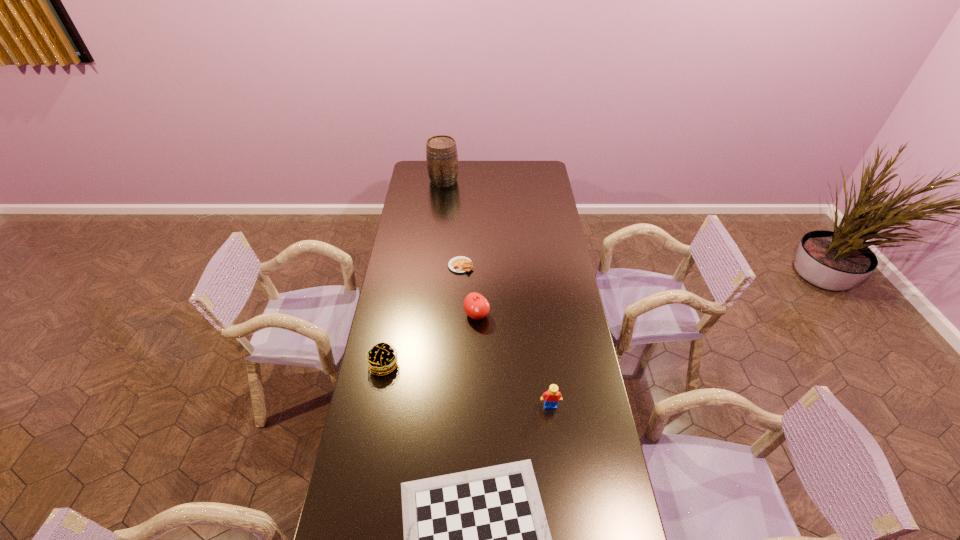
The height and width of the screenshot is (540, 960). I want to click on blank region between the apple and the tallest object, so click(460, 247).

Locate an element on the screen. The image size is (960, 540). empty space between the apple and the farthest object is located at coordinates (460, 247).

At what (x,y) coordinates should I click in order to perform the action: click on vacant space that's between the second nearest object and the omelet. Please return your answer as a coordinate pair (x, y). This screenshot has width=960, height=540. Looking at the image, I should click on (506, 336).

At what (x,y) coordinates should I click in order to perform the action: click on free area in between the fifth farthest object and the patty. Please return your answer as a coordinate pair (x, y). Looking at the image, I should click on (467, 385).

Where is `vacant area that lies between the farthest object and the omelet`? This screenshot has height=540, width=960. vacant area that lies between the farthest object and the omelet is located at coordinates (452, 223).

You are a GUI agent. You are given a task and a screenshot of the screen. Output one action in this format:
    pyautogui.click(x=<x>, y=<y>)
    Task: Click on the vacant point located between the second farthest object and the fourth tallest object
    
    Given the screenshot: What is the action you would take?
    pyautogui.click(x=422, y=315)

Locate an element on the screen. The height and width of the screenshot is (540, 960). vacant space that is in between the farthest object and the second nearest object is located at coordinates (497, 293).

Find the location of `object that is the third closest to the fourth tallest object`. object that is the third closest to the fourth tallest object is located at coordinates (460, 264).

Identify which object is the second nearest to the shortest object. Please provide its 2D coordinates. Your answer should be formatted as a tuple, i.e. [(x, y)], where the tuple contains the x and y coordinates of a point satisfying the conditions above.

[(381, 358)]

You are a GUI agent. You are given a task and a screenshot of the screen. Output one action in this format:
    pyautogui.click(x=<x>, y=<y>)
    Task: Click on the vacant space that satisfies the following two spatial constraints: 1. on the back side of the fourth farthest object; 2. on the right side of the omelet
    
    Given the screenshot: What is the action you would take?
    pyautogui.click(x=402, y=266)